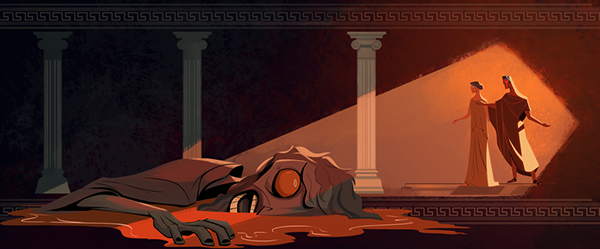
Find the location of a particular element. The height and width of the screenshot is (249, 600). column is located at coordinates click(x=55, y=92), click(x=194, y=80), click(x=367, y=84).